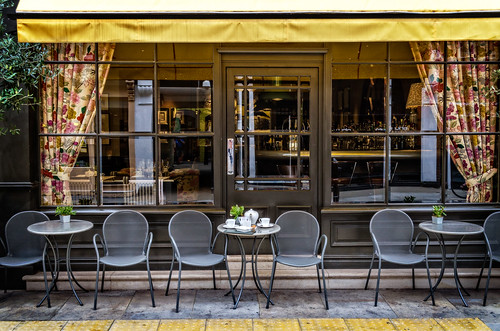
The image size is (500, 331). Identify the location of chairs. (x=22, y=260), (x=116, y=261), (x=205, y=253), (x=303, y=253), (x=389, y=250), (x=489, y=237).